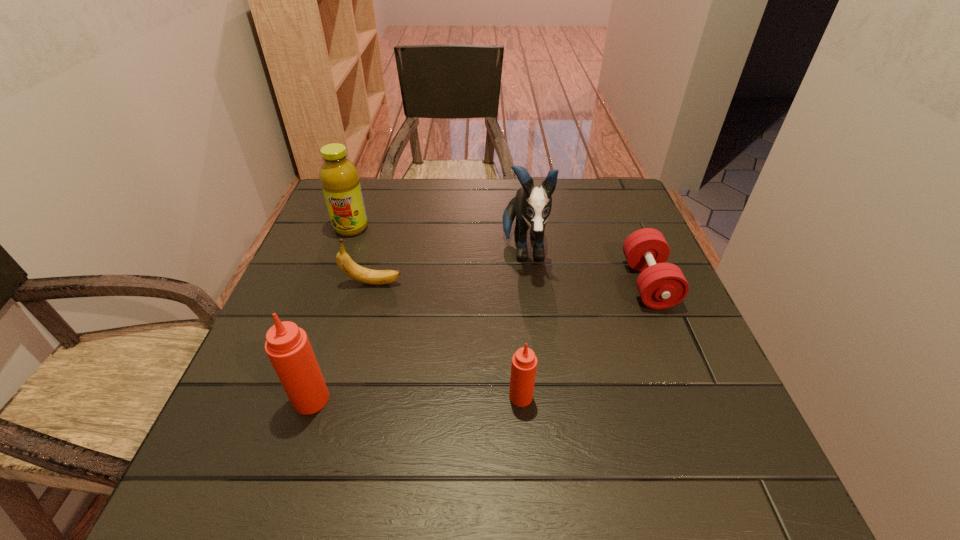
Identify the location of blank space that satisfies the following two spatial constraints: 1. on the front label of the fruit juice; 2. on the right side of the shorter Tabasco sauce. The width and height of the screenshot is (960, 540). (289, 397).

You are a GUI agent. You are given a task and a screenshot of the screen. Output one action in this format:
    pyautogui.click(x=<x>, y=<y>)
    Task: Click on the vacant space that satisfies the following two spatial constraints: 1. on the front label of the fruit juice; 2. on the left side of the taller Tabasco sauce
    This screenshot has height=540, width=960.
    Given the screenshot: What is the action you would take?
    pyautogui.click(x=288, y=399)

Locate an element on the screen. Image resolution: width=960 pixels, height=540 pixels. vacant space that satisfies the following two spatial constraints: 1. on the front-facing side of the puppy; 2. at the start of the peel on the banana is located at coordinates (528, 283).

Image resolution: width=960 pixels, height=540 pixels. I want to click on free space in the image that satisfies the following two spatial constraints: 1. at the start of the peel on the banana; 2. on the back side of the rightmost object, so click(x=372, y=284).

Locate an element on the screen. free spot that satisfies the following two spatial constraints: 1. on the back side of the right Tabasco sauce; 2. on the left side of the dumbbell is located at coordinates (512, 284).

Identify the location of blank area in the image that satisfies the following two spatial constraints: 1. on the back side of the dumbbell; 2. at the start of the peel on the banana. The height and width of the screenshot is (540, 960). (648, 283).

Find the location of a particular element. The width and height of the screenshot is (960, 540). vacant space that satisfies the following two spatial constraints: 1. on the front label of the fruit juice; 2. on the right side of the rightmost object is located at coordinates (330, 284).

You are a GUI agent. You are given a task and a screenshot of the screen. Output one action in this format:
    pyautogui.click(x=<x>, y=<y>)
    Task: Click on the free location that satisfies the following two spatial constraints: 1. on the front-facing side of the tallest object; 2. at the start of the peel on the banana
    This screenshot has width=960, height=540.
    Given the screenshot: What is the action you would take?
    pyautogui.click(x=528, y=283)